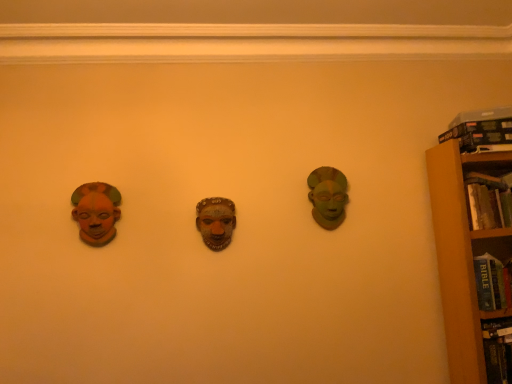
Measure the distance between point (89, 187) and camera.

The depth of point (89, 187) is 2.02 meters.

This screenshot has width=512, height=384. I want to click on brown wooden bookcase at right, so click(463, 254).

What do you see at coordinates (480, 134) in the screenshot?
I see `hardcover book at upper right, the first book positioned from the top` at bounding box center [480, 134].

Locate an element on the screen. The image size is (512, 384). matte orange mask at left, the first head in the front-to-back sequence is located at coordinates (96, 212).

Based on the photo, is hardcover book at upper right, the first book positioned from the top, not near matte orange mask at left, acting as the second head starting from the back?

Absolutely, hardcover book at upper right, the first book positioned from the top, is distant from matte orange mask at left, acting as the second head starting from the back.

Is point (469, 127) positioned behind point (87, 237)?

Yes, point (469, 127) is farther from viewer.

How distant is hardcover book at upper right, the first book positioned from the top, from matte orange mask at left, the 2th head from the right?

1.77 meters.

From a real-world perspective, is hardcover book at upper right, the first book positioned from the top, above or below matte orange mask at left, the 2th head from the right?

In terms of real-world spatial position, hardcover book at upper right, the first book positioned from the top, is above matte orange mask at left, the 2th head from the right.

From a real-world perspective, relative to matte orange mask at left, which appears as the first head when viewed from the left, is brown wooden bookcase at right vertically above or below?

brown wooden bookcase at right is below matte orange mask at left, which appears as the first head when viewed from the left.

Is brown wooden bookcase at right turned away from matte orange mask at left, acting as the second head starting from the back?

That's not correct — brown wooden bookcase at right is not looking away from matte orange mask at left, acting as the second head starting from the back.

Considering the relative sizes of brown wooden bookcase at right and matte orange mask at left, acting as the second head starting from the back, in the image provided, is brown wooden bookcase at right bigger than matte orange mask at left, acting as the second head starting from the back,?

Indeed, brown wooden bookcase at right has a larger size compared to matte orange mask at left, acting as the second head starting from the back.

Is brown wooden bookcase at right next to matte orange mask at left, the 2th head from the right, and touching it?

They are not placed beside each other.

Is hardcover book at upper right, the first book positioned from the top, inside the boundaries of green matte mask at center right, acting as the 1th head starting from the back, or outside?

hardcover book at upper right, the first book positioned from the top, lies outside green matte mask at center right, acting as the 1th head starting from the back.

Is hardcover book at upper right, acting as the 2th book starting from the bottom, at the left side of green matte mask at center right, the 2th head when ordered from left to right?

In fact, hardcover book at upper right, acting as the 2th book starting from the bottom, is to the right of green matte mask at center right, the 2th head when ordered from left to right.

Considering the sizes of objects hardcover book at upper right, acting as the 2th book starting from the bottom, and green matte mask at center right, which is the first head in right-to-left order, in the image provided, who is wider, hardcover book at upper right, acting as the 2th book starting from the bottom, or green matte mask at center right, which is the first head in right-to-left order,?

hardcover book at upper right, acting as the 2th book starting from the bottom.

Is hardcover book at upper right, acting as the 2th book starting from the bottom, positioned with its back to green matte mask at center right, acting as the 1th head starting from the back?

hardcover book at upper right, acting as the 2th book starting from the bottom, does not have its back to green matte mask at center right, acting as the 1th head starting from the back.

Considering the positions of objects hardcover book at upper right, acting as the 2th book starting from the bottom, and brown wooden bookcase at right in the image provided, who is behind, hardcover book at upper right, acting as the 2th book starting from the bottom, or brown wooden bookcase at right?

hardcover book at upper right, acting as the 2th book starting from the bottom, is further from the camera.

The image size is (512, 384). Find the location of `bookcase on the right of hardcover book at upper right, the first book positioned from the top`. bookcase on the right of hardcover book at upper right, the first book positioned from the top is located at coordinates (463, 254).

Which of these two, hardcover book at upper right, the first book positioned from the top, or brown wooden bookcase at right, stands shorter?

hardcover book at upper right, the first book positioned from the top.

Which is closer, (488, 125) or (503, 167)?

Point (503, 167)

Is hardcover book at upper right, acting as the 2th book starting from the bottom, surrounded by green matte mask at center right, which is the first head in right-to-left order?

Actually, hardcover book at upper right, acting as the 2th book starting from the bottom, is outside green matte mask at center right, which is the first head in right-to-left order.

Looking at this image, who is bigger, green matte mask at center right, acting as the 1th head starting from the back, or hardcover book at upper right, acting as the 2th book starting from the bottom?

hardcover book at upper right, acting as the 2th book starting from the bottom, is bigger.

How different are the orientations of green matte mask at center right, which is the first head in right-to-left order, and hardcover book at upper right, the first book positioned from the top, in degrees?

0.0516 degrees separate the facing orientations of green matte mask at center right, which is the first head in right-to-left order, and hardcover book at upper right, the first book positioned from the top.

Is green matte mask at center right, the 2th head when ordered from left to right, to the left of hardcover book at upper right, the first book positioned from the top, from the viewer's perspective?

Yes, green matte mask at center right, the 2th head when ordered from left to right, is to the left of hardcover book at upper right, the first book positioned from the top.

Where is `the 2nd book behind the brown wooden bookcase at right`? This screenshot has height=384, width=512. the 2nd book behind the brown wooden bookcase at right is located at coordinates (480, 134).

In the scene shown: From the image's perspective, which is above, brown wooden bookcase at right or hardcover book at upper right, the first book positioned from the top?

hardcover book at upper right, the first book positioned from the top.

Can you tell me how much brown wooden bookcase at right and hardcover book at upper right, the first book positioned from the top, differ in facing direction?

0.0405 degrees separate the facing orientations of brown wooden bookcase at right and hardcover book at upper right, the first book positioned from the top.

From a real-world perspective, who is located lower, brown wooden bookcase at right or hardcover book at upper right, the first book positioned from the top?

brown wooden bookcase at right.

Find the location of a particular element. book that is the 2nd object located behind the matte orange mask at left, acting as the second head starting from the back is located at coordinates (480, 134).

Considering the relative sizes of matte orange mask at left, the 2th head from the right, and hardcover book at upper right, acting as the 2th book starting from the bottom, in the image provided, is matte orange mask at left, the 2th head from the right, smaller than hardcover book at upper right, acting as the 2th book starting from the bottom,?

Yes.

From a real-world perspective, does matte orange mask at left, the 2th head from the right, sit lower than hardcover book at upper right, acting as the 2th book starting from the bottom?

Correct, in the physical world, matte orange mask at left, the 2th head from the right, is lower than hardcover book at upper right, acting as the 2th book starting from the bottom.

Consider the image. Is matte orange mask at left, the 2th head from the right, shorter than hardcover book at upper right, acting as the 2th book starting from the bottom?

In fact, matte orange mask at left, the 2th head from the right, may be taller than hardcover book at upper right, acting as the 2th book starting from the bottom.

I want to click on the 2nd book above the matte orange mask at left, the first head in the front-to-back sequence (from the image's perspective), so click(x=480, y=134).

Locate an element on the screen. bookcase on the right of matte orange mask at left, which appears as the first head when viewed from the left is located at coordinates (463, 254).

Which object lies further to the anchor point green matte mask at center right, acting as the second head starting from the front, hardcover book at upper right, the first book positioned from the top, or hardcover book at right, which is counted as the 2th book, starting from the top?

hardcover book at upper right, the first book positioned from the top, lies further to green matte mask at center right, acting as the second head starting from the front, than the other object.

Consider the image. From the image, which object appears to be nearer to brown wooden bookcase at right, hardcover book at upper right, the first book positioned from the top, or matte orange mask at left, acting as the second head starting from the back?

hardcover book at upper right, the first book positioned from the top, is closer to brown wooden bookcase at right.

Which object lies further to the anchor point green matte mask at center right, the 2th head when ordered from left to right, hardcover book at right, arranged as the 1th book when ordered from the bottom, or hardcover book at upper right, the first book positioned from the top?

hardcover book at upper right, the first book positioned from the top, lies further to green matte mask at center right, the 2th head when ordered from left to right, than the other object.

When comparing their distances from green matte mask at center right, acting as the second head starting from the front, does brown wooden bookcase at right or hardcover book at right, which is counted as the 2th book, starting from the top, seem closer?

brown wooden bookcase at right.

Estimate the real-world distances between objects in this image. Which object is closer to hardcover book at upper right, the first book positioned from the top, matte orange mask at left, acting as the second head starting from the back, or green matte mask at center right, which is the first head in right-to-left order?

green matte mask at center right, which is the first head in right-to-left order, lies closer to hardcover book at upper right, the first book positioned from the top, than the other object.

From the image, which object appears to be farther from green matte mask at center right, which is the first head in right-to-left order, hardcover book at upper right, the first book positioned from the top, or matte orange mask at left, the first head in the front-to-back sequence?

matte orange mask at left, the first head in the front-to-back sequence, lies further to green matte mask at center right, which is the first head in right-to-left order, than the other object.

Looking at this image, when comparing their distances from matte orange mask at left, acting as the second head starting from the back, does hardcover book at right, arranged as the 1th book when ordered from the bottom, or green matte mask at center right, acting as the second head starting from the front, seem closer?

green matte mask at center right, acting as the second head starting from the front, is closer to matte orange mask at left, acting as the second head starting from the back.

When comparing their distances from matte orange mask at left, the 2th head from the right, does green matte mask at center right, acting as the 1th head starting from the back, or hardcover book at right, which is counted as the 2th book, starting from the top, seem further?

Based on the image, hardcover book at right, which is counted as the 2th book, starting from the top, appears to be further to matte orange mask at left, the 2th head from the right.

This screenshot has height=384, width=512. I want to click on book situated between matte orange mask at left, the 2th head from the right, and hardcover book at upper right, the first book positioned from the top, from left to right, so click(x=487, y=201).

Locate an element on the screen. head situated between matte orange mask at left, which appears as the first head when viewed from the left, and hardcover book at upper right, the first book positioned from the top, from left to right is located at coordinates (328, 196).

Where is `head between matte orange mask at left, which appears as the first head when viewed from the left, and hardcover book at right, arranged as the 1th book when ordered from the bottom`? head between matte orange mask at left, which appears as the first head when viewed from the left, and hardcover book at right, arranged as the 1th book when ordered from the bottom is located at coordinates (328, 196).

The width and height of the screenshot is (512, 384). Identify the location of book between hardcover book at upper right, the first book positioned from the top, and brown wooden bookcase at right vertically. (487, 201).